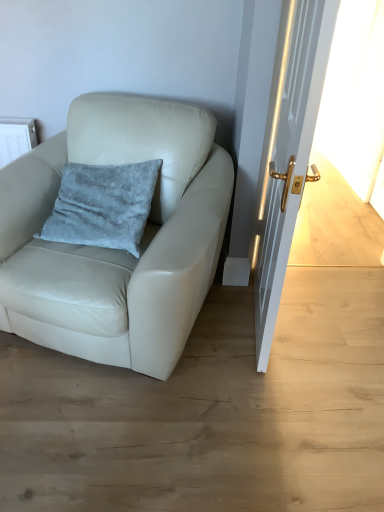
Question: Is white leather chair at left oriented away from velvety blue pillow at center-left?

Choices:
 (A) no
 (B) yes

Answer: (B)

Question: Considering the relative sizes of white leather chair at left and velvety blue pillow at center-left in the image provided, is white leather chair at left taller than velvety blue pillow at center-left?

Choices:
 (A) yes
 (B) no

Answer: (A)

Question: Is white leather chair at left oriented towards velvety blue pillow at center-left?

Choices:
 (A) yes
 (B) no

Answer: (A)

Question: Does white leather chair at left appear on the right side of velvety blue pillow at center-left?

Choices:
 (A) yes
 (B) no

Answer: (A)

Question: Does white leather chair at left have a smaller size compared to velvety blue pillow at center-left?

Choices:
 (A) yes
 (B) no

Answer: (B)

Question: Is white leather chair at left with velvety blue pillow at center-left?

Choices:
 (A) yes
 (B) no

Answer: (B)

Question: Can you confirm if velvety blue pillow at center-left is smaller than white glossy door at right?

Choices:
 (A) no
 (B) yes

Answer: (B)

Question: Considering the relative sizes of velvety blue pillow at center-left and white glossy door at right in the image provided, is velvety blue pillow at center-left thinner than white glossy door at right?

Choices:
 (A) yes
 (B) no

Answer: (B)

Question: From a real-world perspective, is velvety blue pillow at center-left over white glossy door at right?

Choices:
 (A) yes
 (B) no

Answer: (B)

Question: Is velvety blue pillow at center-left positioned before white glossy door at right?

Choices:
 (A) yes
 (B) no

Answer: (B)

Question: From the image's perspective, would you say velvety blue pillow at center-left is shown under white glossy door at right?

Choices:
 (A) no
 (B) yes

Answer: (B)

Question: Can you confirm if velvety blue pillow at center-left is wider than white glossy door at right?

Choices:
 (A) yes
 (B) no

Answer: (A)

Question: Is white glossy door at right not near white leather chair at left?

Choices:
 (A) no
 (B) yes

Answer: (A)